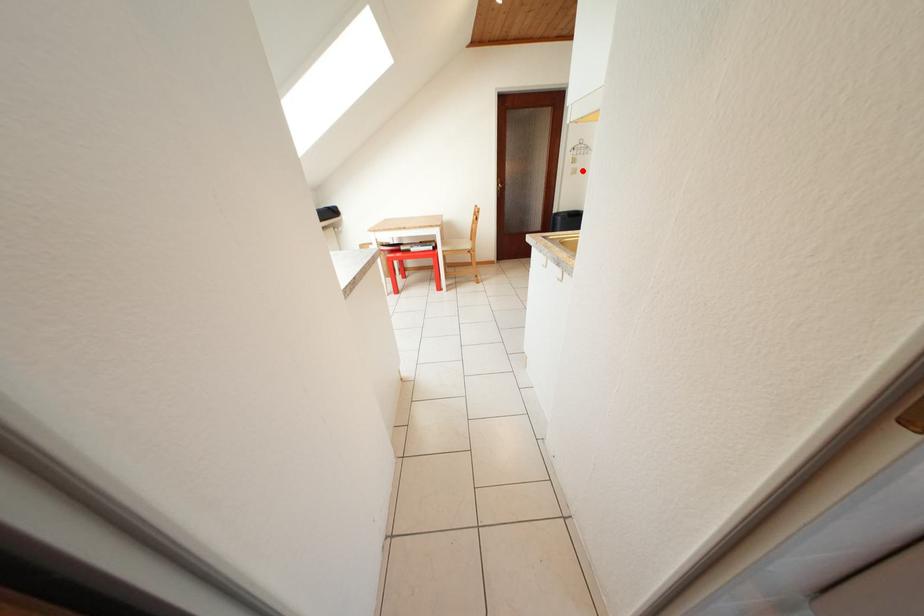
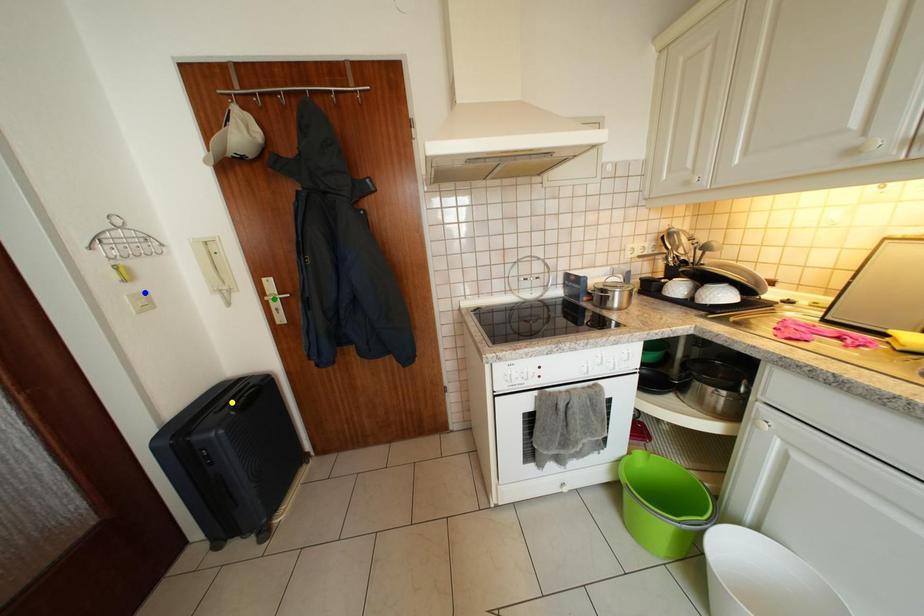
Question: I am providing you with two images of the same scene from different viewpoints. A red point is marked on the first image. You are given multiple points on the second image. Which mark in image 2 goes with the point in image 1?

Choices:
 (A) blue point
 (B) green point
 (C) yellow point

Answer: (A)